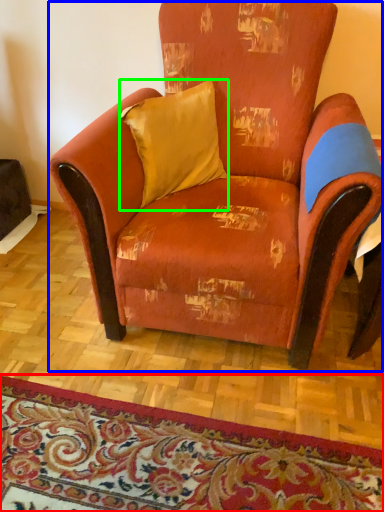
Question: Considering the real-world distances, which object is farthest from mat (highlighted by a red box)? chair (highlighted by a blue box) or pillow (highlighted by a green box)?

Choices:
 (A) chair
 (B) pillow

Answer: (B)